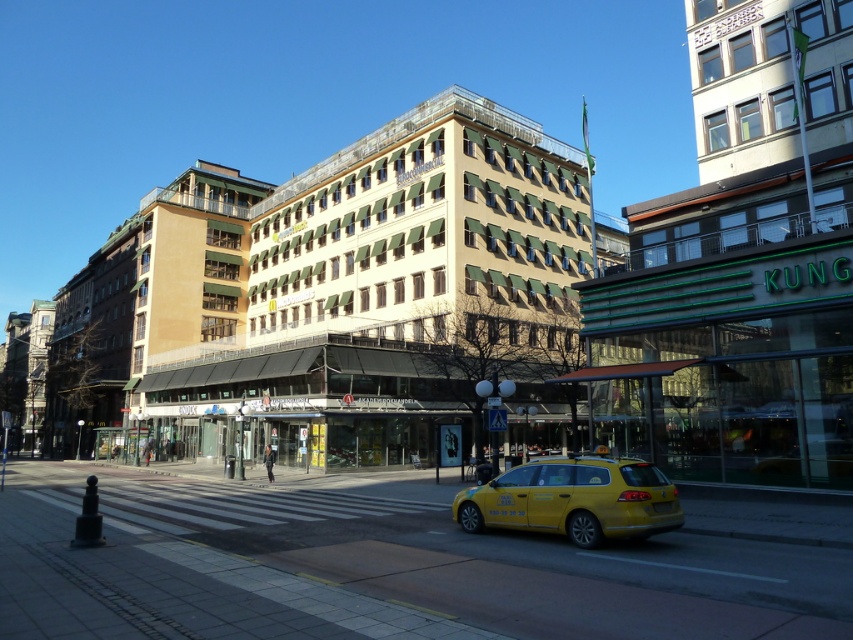
Does white glass building at upper right appear on the right side of yellow matte taxi at lower center?

Yes, white glass building at upper right is to the right of yellow matte taxi at lower center.

What do you see at coordinates (740, 268) in the screenshot? I see `white glass building at upper right` at bounding box center [740, 268].

The image size is (853, 640). What do you see at coordinates (740, 268) in the screenshot?
I see `white glass building at upper right` at bounding box center [740, 268].

Locate an element on the screen. The image size is (853, 640). white glass building at upper right is located at coordinates (740, 268).